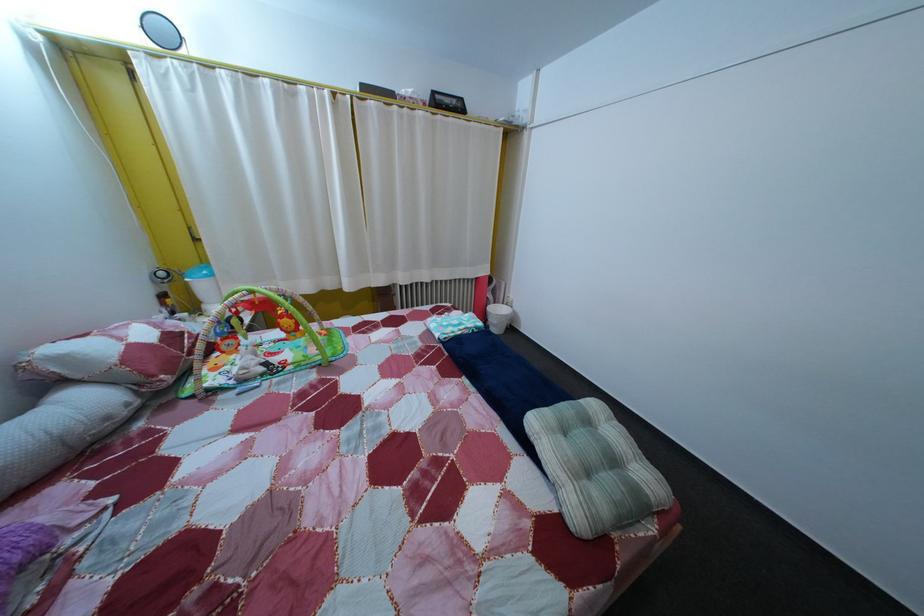
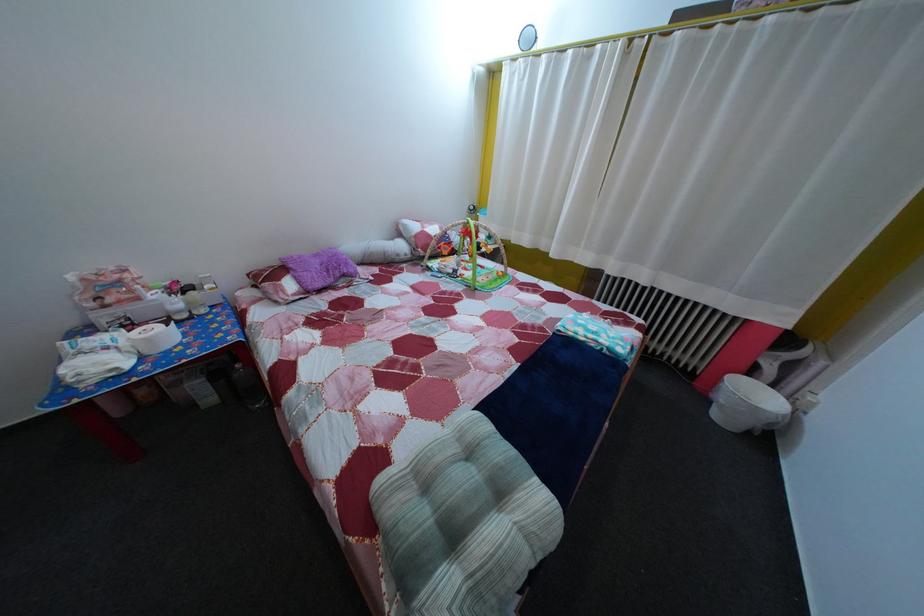
Find the pixel in the second image that matches [507,320] in the first image.

(760, 402)